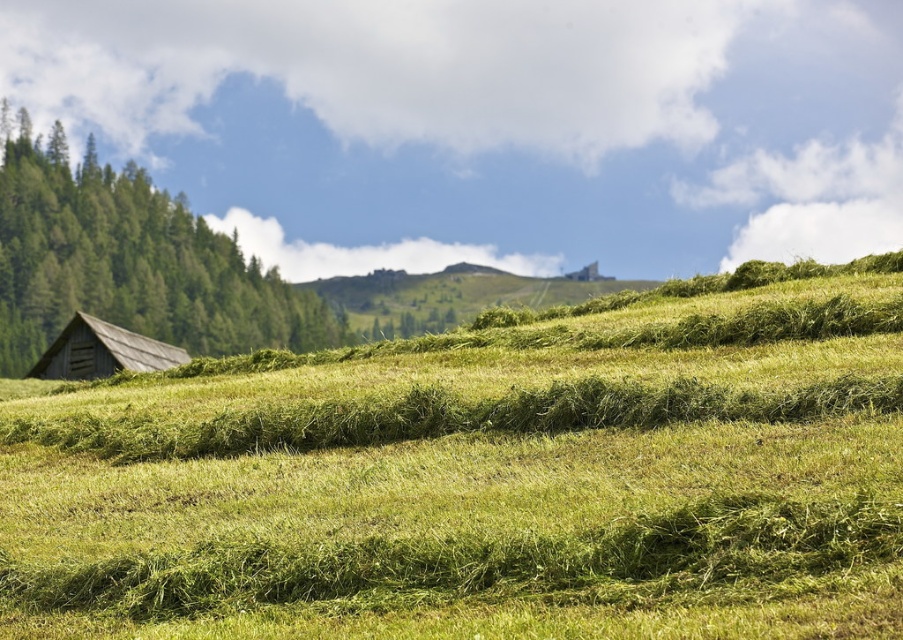
Question: Is green grassy field at center to the left of green matte tree at left from the viewer's perspective?

Choices:
 (A) no
 (B) yes

Answer: (A)

Question: Is green grassy field at center above green matte tree at left?

Choices:
 (A) no
 (B) yes

Answer: (A)

Question: Which point appears closest to the camera in this image?

Choices:
 (A) (103, 305)
 (B) (417, 627)
 (C) (183, 358)

Answer: (B)

Question: Which object is the farthest from the green grassy field at center?

Choices:
 (A) green matte tree at left
 (B) wooden barn at lower left

Answer: (A)

Question: Which is farther from the green matte tree at left?

Choices:
 (A) wooden barn at lower left
 (B) green grassy field at center

Answer: (B)

Question: Can you confirm if green matte tree at left is thinner than wooden barn at lower left?

Choices:
 (A) no
 (B) yes

Answer: (A)